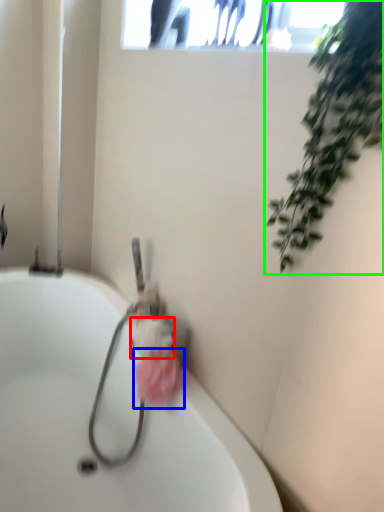
Question: Considering the real-world distances, which object is closest to flower (highlighted by a red box)? flower (highlighted by a blue box) or houseplant (highlighted by a green box).

Choices:
 (A) flower
 (B) houseplant

Answer: (A)